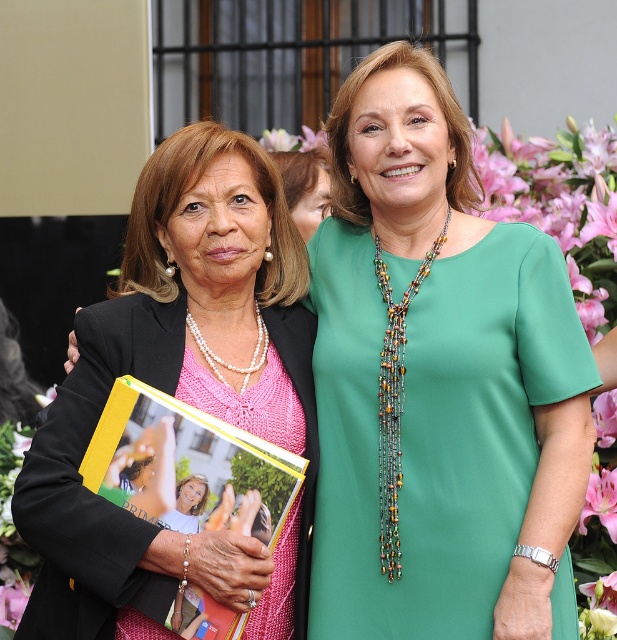
You are at a formal event and need to navigate between two points marked as point (242, 252) and point (262, 145). Which point is closer to the woman holding the yellow book?

Point (242, 252) is in front of point (262, 145), so it is closer to the woman holding the yellow book.

You are a photographer at a wedding event. You need to capture a closeup shot of the green fabric dress at center and the pink silk flower at upper center. Given that the camera can only focus on one object at a time, which object should you prioritize to ensure the dress is in focus? Please explain your reasoning based on their sizes.

The green fabric dress at center is larger in size compared to the pink silk flower at upper center. To ensure the dress is in focus, you should prioritize focusing on the green fabric dress at center since its larger size requires more detailed capture.